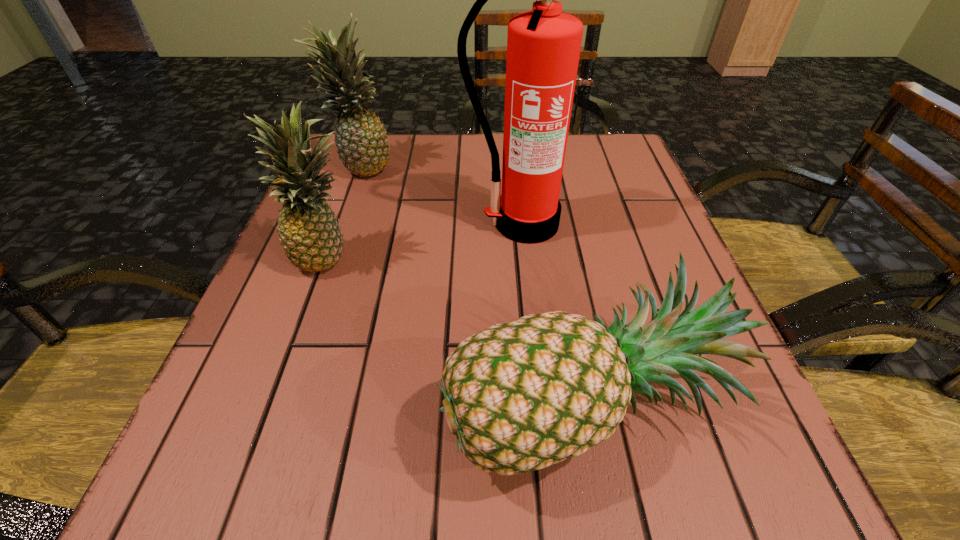
Where is `object that is positioned at the near edge`? The height and width of the screenshot is (540, 960). object that is positioned at the near edge is located at coordinates (520, 396).

At what (x,y) coordinates should I click in order to perform the action: click on object present at the right edge. Please return your answer as a coordinate pair (x, y). This screenshot has width=960, height=540. Looking at the image, I should click on (520, 396).

You are a GUI agent. You are given a task and a screenshot of the screen. Output one action in this format:
    pyautogui.click(x=<x>, y=<y>)
    Task: Click on the object that is at the far left corner
    This screenshot has height=540, width=960.
    Given the screenshot: What is the action you would take?
    pyautogui.click(x=361, y=141)

You are a GUI agent. You are given a task and a screenshot of the screen. Output one action in this format:
    pyautogui.click(x=<x>, y=<y>)
    Task: Click on the object positioned at the near right corner
    The width and height of the screenshot is (960, 540).
    Given the screenshot: What is the action you would take?
    pyautogui.click(x=520, y=396)

The image size is (960, 540). In order to click on vacant region at the far edge of the desktop in this screenshot , I will do `click(566, 185)`.

Identify the location of vacant space at the near edge of the desktop. The width and height of the screenshot is (960, 540). (516, 495).

Identify the location of free space at the left edge of the desktop. (366, 195).

Image resolution: width=960 pixels, height=540 pixels. In order to click on free location at the far right corner of the desktop in this screenshot , I will do `click(606, 160)`.

Identify the location of free spot between the farthest pineapple and the tallest object. (443, 195).

The width and height of the screenshot is (960, 540). Identify the location of vacant point located between the fire extinguisher and the second nearest pineapple. (426, 240).